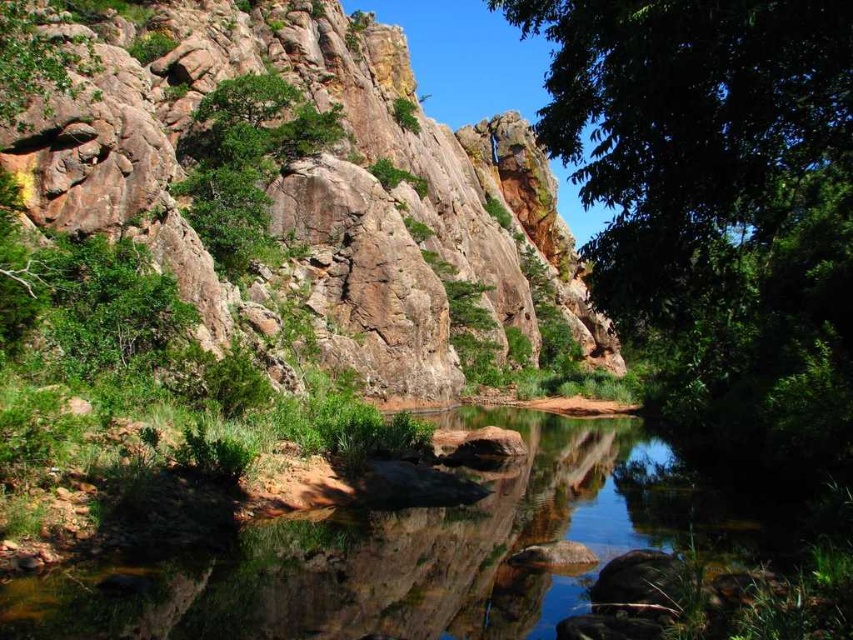
Question: Can you confirm if rustic stone hillside at upper center is positioned below green rough textured tree at upper center?

Choices:
 (A) no
 (B) yes

Answer: (A)

Question: Which point is farther to the camera?

Choices:
 (A) green rough textured tree at upper center
 (B) clear water at center

Answer: (A)

Question: Which is nearer to the rustic stone hillside at upper center?

Choices:
 (A) clear water at center
 (B) green rough textured tree at upper center

Answer: (B)

Question: Which point is farther from the camera taking this photo?

Choices:
 (A) (547, 512)
 (B) (190, 131)

Answer: (B)

Question: Does clear water at center appear on the right side of green rough textured tree at upper center?

Choices:
 (A) no
 (B) yes

Answer: (B)

Question: Is clear water at center to the left of green rough textured tree at upper center from the viewer's perspective?

Choices:
 (A) no
 (B) yes

Answer: (A)